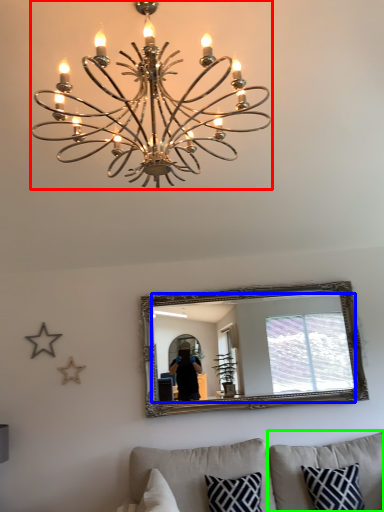
Question: Considering the real-world distances, which object is closest to lamp (highlighted by a red box)? mirror (highlighted by a blue box) or pillow (highlighted by a green box).

Choices:
 (A) mirror
 (B) pillow

Answer: (A)